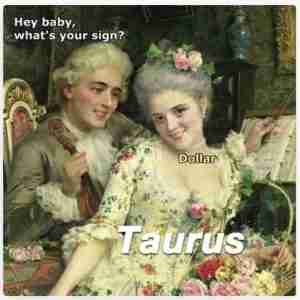
Find the location of a particular element. chair back is located at coordinates (20, 119).